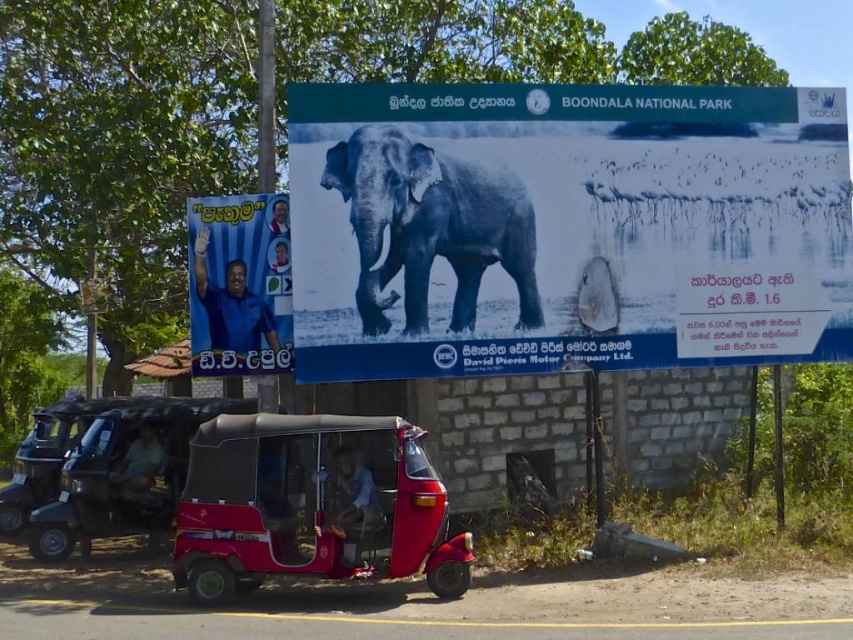
You are standing at the roadside scene and want to take a photo of both the billboard and the smaller poster. Which point, point (724,93) or point (180,456), should you focus on first to ensure both are in clear view?

Point (724,93) is closer to the camera than point (180,456). To ensure both are in clear view, focus on point (724,93) first as it is closer, allowing the camera to adjust focus for the nearer object before capturing the farther one.

You are a delivery person who needs to load a package onto the black plastic golf cart at lower left. The package is taller than the blue fabric poster at left. Can you safely place the package on the golf cart without it falling over?

The black plastic golf cart at lower left has a lesser height compared to the blue fabric poster at left. Since the package is taller than the poster, it will exceed the golf cart height, making it unstable and likely to fall over. Do not place the package there.